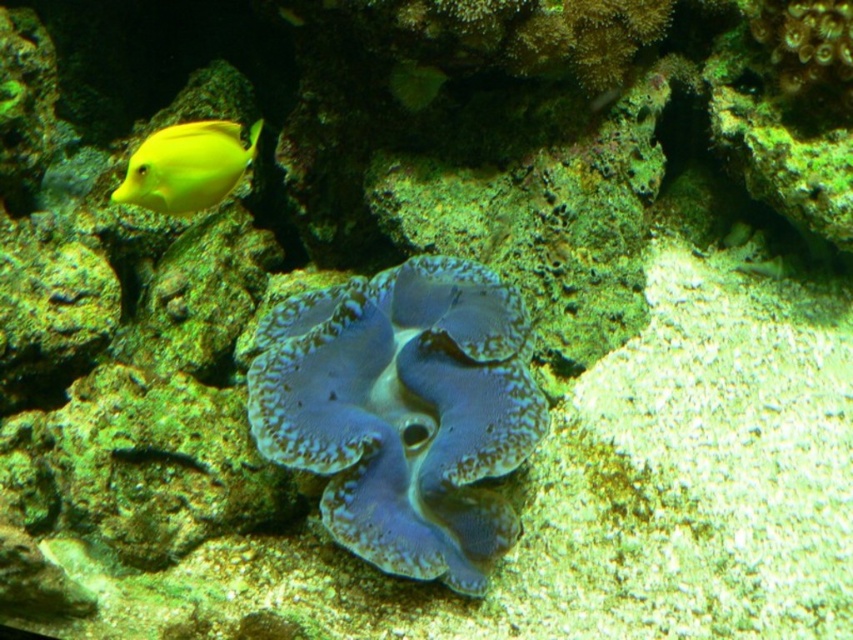
You are a scuba diver swimming in the underwater scene. You see two points marked in the image. The first point is at coordinates point [438,438] and the second point is at point [183,196]. Which point is closer to you as you face the giant clam?

Point [438,438] is in front of point [183,196], so it is closer to you as you face the giant clam.

You are a scuba diver swimming in the underwater scene. You notice the blue textured clam at center and the yellow matte fish at upper left. Which object is nearer to you?

The blue textured clam at center is closer to the viewer than the yellow matte fish at upper left.

Based on the photo, you are a marine biologist holding a 1.2 meter long measuring tape. You want to measure the distance between you and the blue textured clam at center. Can you fully extend your measuring tape to reach it?

The blue textured clam at center and camera are 1.56 meters apart. Since the measuring tape is only 1.2 meters long, it cannot fully reach the distance. You will need a longer measuring tape.